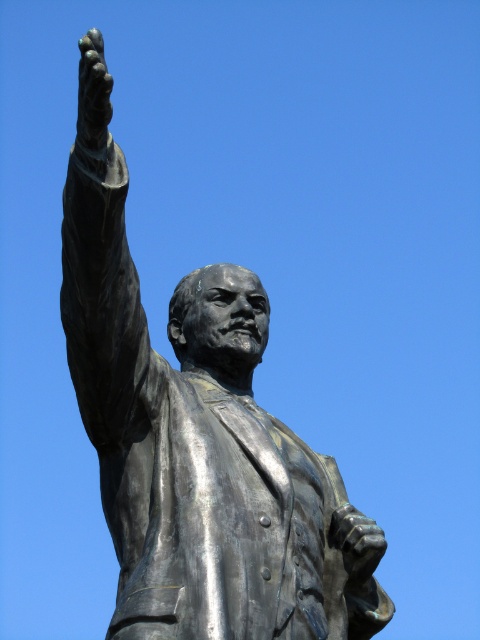
Question: Which point is closer to the camera?

Choices:
 (A) polished bronze hand at upper left
 (B) bronze statue at upper center

Answer: (A)

Question: Is the position of bronze statue at upper center more distant than that of polished bronze hand at upper left?

Choices:
 (A) yes
 (B) no

Answer: (A)

Question: From the image, what is the correct spatial relationship of bronze statue at upper center in relation to polished bronze hand at upper left?

Choices:
 (A) below
 (B) above

Answer: (A)

Question: Can you confirm if bronze statue at upper center is smaller than polished bronze hand at upper left?

Choices:
 (A) no
 (B) yes

Answer: (B)